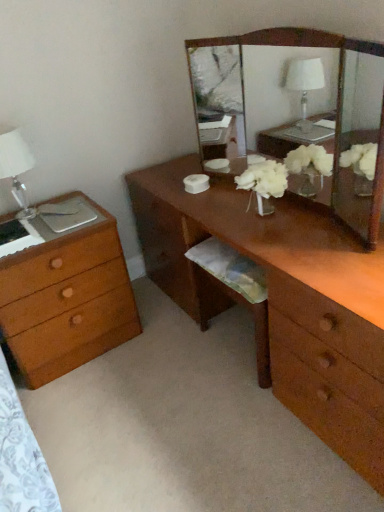
Question: From a real-world perspective, is brown wooden desk at center located higher than wooden chest of drawers at left?

Choices:
 (A) yes
 (B) no

Answer: (A)

Question: Is brown wooden desk at center to the right of wooden chest of drawers at left from the viewer's perspective?

Choices:
 (A) yes
 (B) no

Answer: (A)

Question: Is brown wooden desk at center located outside wooden chest of drawers at left?

Choices:
 (A) yes
 (B) no

Answer: (A)

Question: Is brown wooden desk at center wider than wooden chest of drawers at left?

Choices:
 (A) yes
 (B) no

Answer: (B)

Question: Is the depth of brown wooden desk at center greater than that of wooden chest of drawers at left?

Choices:
 (A) yes
 (B) no

Answer: (B)

Question: From the image's perspective, is wooden chest of drawers at left positioned above or below white glass table lamp at left?

Choices:
 (A) above
 (B) below

Answer: (B)

Question: From a real-world perspective, is wooden chest of drawers at left positioned above or below white glass table lamp at left?

Choices:
 (A) below
 (B) above

Answer: (A)

Question: Is wooden chest of drawers at left wider or thinner than white glass table lamp at left?

Choices:
 (A) thin
 (B) wide

Answer: (B)

Question: In the image, is wooden chest of drawers at left positioned in front of or behind white glass table lamp at left?

Choices:
 (A) front
 (B) behind

Answer: (A)

Question: Considering their positions, is wooden mirror at center located in front of or behind wooden chest of drawers at left?

Choices:
 (A) front
 (B) behind

Answer: (A)

Question: In terms of size, does wooden mirror at center appear bigger or smaller than wooden chest of drawers at left?

Choices:
 (A) small
 (B) big

Answer: (A)

Question: From a real-world perspective, is wooden mirror at center physically located above or below wooden chest of drawers at left?

Choices:
 (A) above
 (B) below

Answer: (A)

Question: Does point (317, 182) appear closer or farther from the camera than point (77, 354)?

Choices:
 (A) farther
 (B) closer

Answer: (B)

Question: From a real-world perspective, is wooden chest of drawers at left physically located above or below brown wooden desk at center?

Choices:
 (A) below
 (B) above

Answer: (A)

Question: Do you think wooden chest of drawers at left is within brown wooden desk at center, or outside of it?

Choices:
 (A) inside
 (B) outside

Answer: (B)